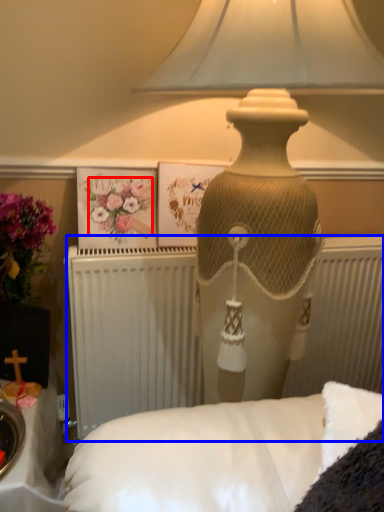
Question: Which of the following is the farthest to the observer, flower (highlighted by a red box) or radiator (highlighted by a blue box)?

Choices:
 (A) flower
 (B) radiator

Answer: (A)